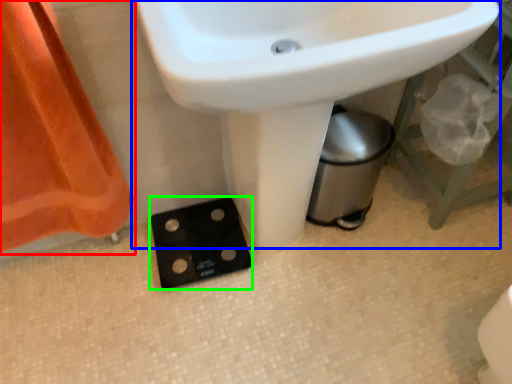
Question: Which object is the closest to the curtain (highlighted by a red box)? Choose among these: sink (highlighted by a blue box) or socket (highlighted by a green box).

Choices:
 (A) sink
 (B) socket

Answer: (B)